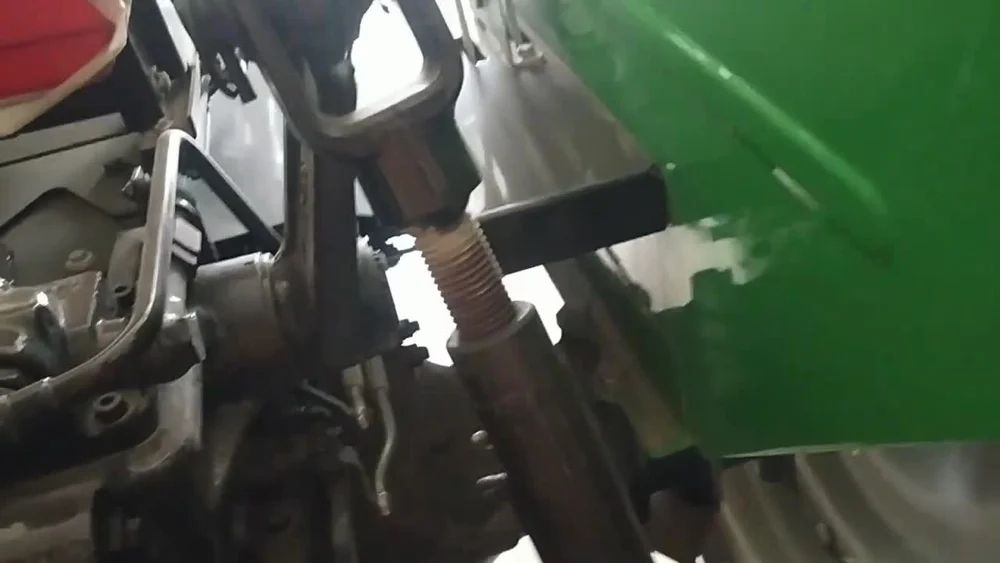
I want to click on washers, so click(x=104, y=403), click(x=121, y=292).